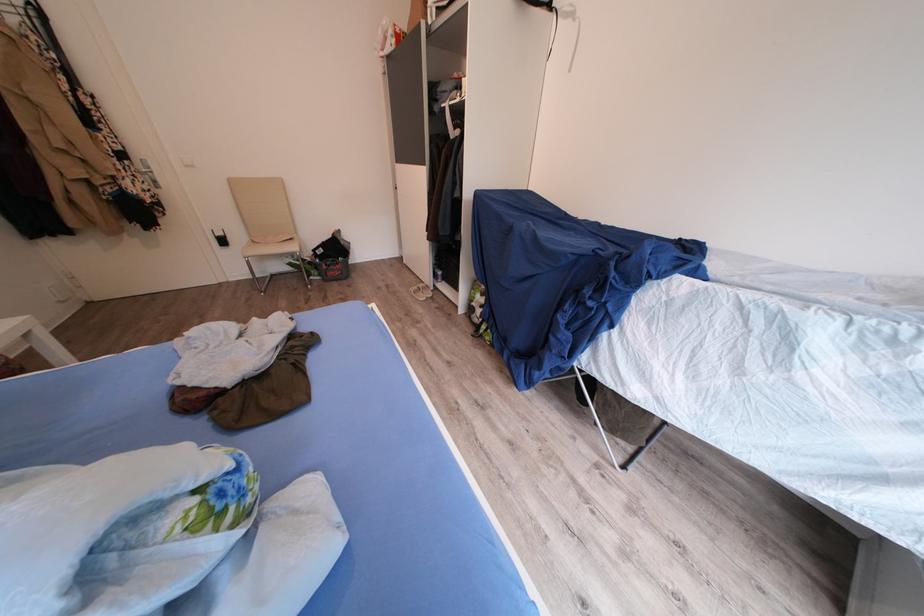
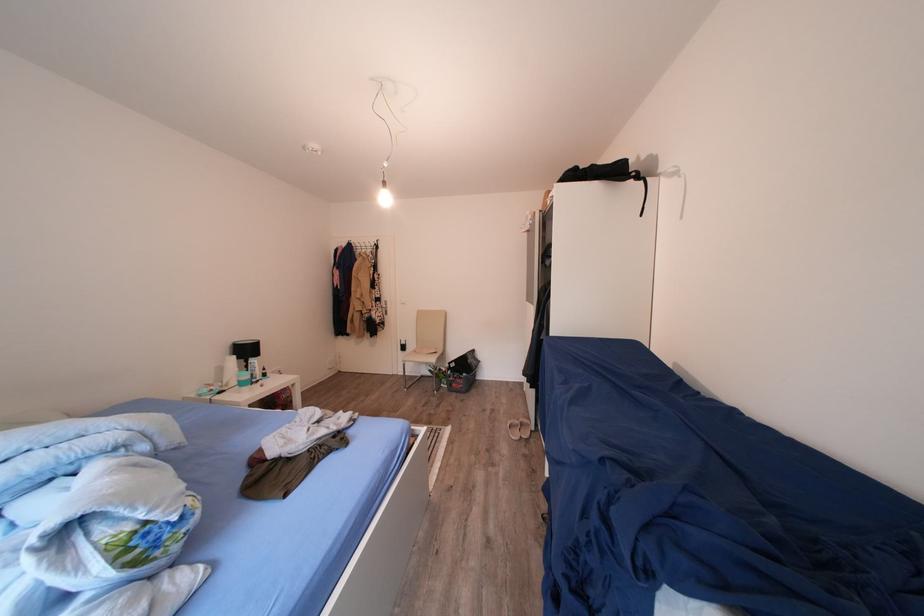
The point at (x=424, y=293) is marked in the first image. Where is the corresponding point in the second image?

(526, 427)